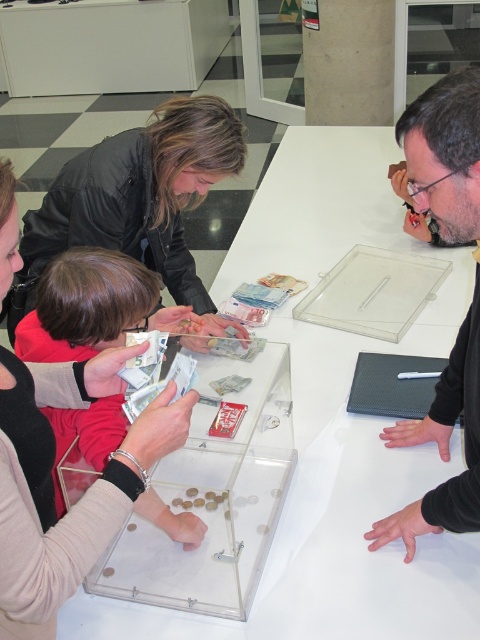
You are a visitor at the exhibit and want to touch the transparent acrylic box at center. To reach it, you need to walk around the transparent plastic table at center. Which direction should you go to move from the table to the box?

The transparent plastic table at center is to the right of the transparent acrylic box at center, so you should move to the left to go from the table to the box.

You are organizing a workshop and need to set up a table with both the black matte laptop at upper right and the red fabric child at lower left. Based on their sizes, which object should be placed first to ensure there is enough space for both?

The black matte laptop at upper right should be placed first because it has a larger size compared to the red fabric child at lower left, ensuring there is enough space for both.

You are a visitor at the museum and want to reach the transparent acrylic box at center from your current position. There is a 3.5 feet wide wheelchair ramp nearby. Can you safely navigate to the box using the ramp?

The distance between you and the transparent acrylic box at center is 3.42 feet, and the wheelchair ramp is 3.5 feet wide. Since the ramp is slightly wider than the required distance, you can safely navigate to the box using the ramp.